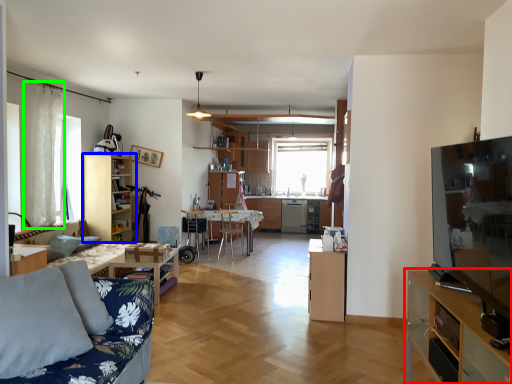
Question: Which object is positioned closest to cabinetry (highlighted by a red box)? Select from cabinetry (highlighted by a blue box) and curtain (highlighted by a green box).

Choices:
 (A) cabinetry
 (B) curtain

Answer: (B)